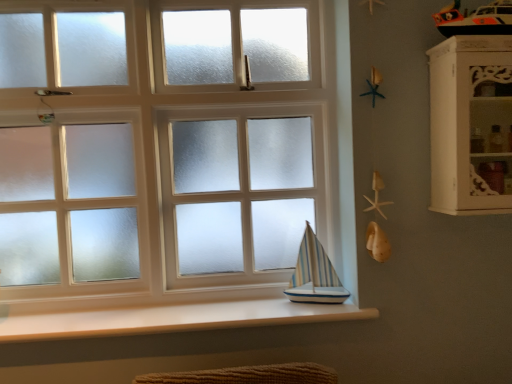
This screenshot has height=384, width=512. Identify the location of blank space situated above white smooth wood at lower center (from a real-world perspective). (140, 309).